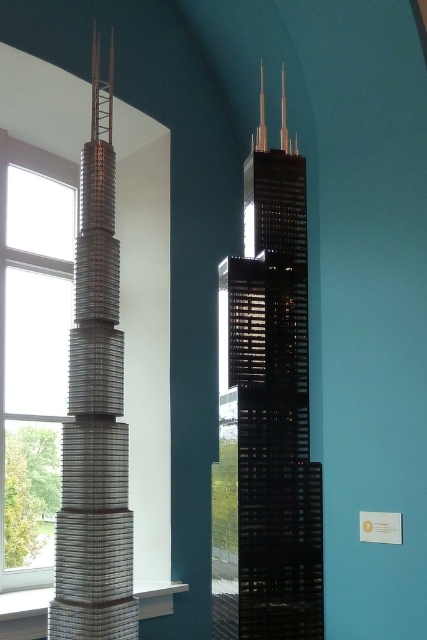
You are an architect examining two skyscraper models in a gallery. You see the black glass tower at center and the metallic silver tower at left. Which model is positioned to the right of the other?

The black glass tower at center is positioned to the right of the metallic silver tower at left.

You are an architect examining two skyscraper models displayed in a room. You notice a point marked at coordinates (266, 413). Which model does this point indicate?

The point at coordinates (266, 413) corresponds to the black glass tower at center.

You are an architect reviewing the models displayed in the image. Which of the two towers, the black glass tower at center or the metallic silver tower at left, is positioned higher up in the image?

The metallic silver tower at left is positioned higher up in the image because the black glass tower at center is located below it.